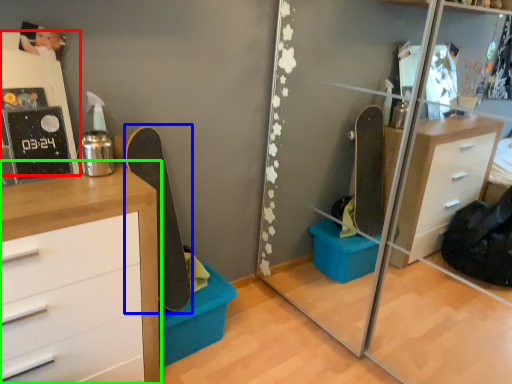
Question: Estimate the real-world distances between objects in this image. Which object is farther from shelf (highlighted by a red box), skateboard (highlighted by a blue box) or chest of drawers (highlighted by a green box)?

Choices:
 (A) skateboard
 (B) chest of drawers

Answer: (A)